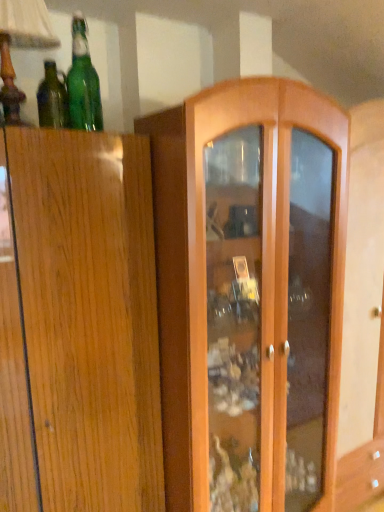
Question: Is green glass bottle at upper left, which appears as the 2th bottle when viewed from the left, taller or shorter than green glass bottle at upper left, placed as the 2th bottle when sorted from right to left?

Choices:
 (A) short
 (B) tall

Answer: (B)

Question: Looking at their shapes, would you say green glass bottle at upper left, placed as the first bottle when sorted from right to left, is wider or thinner than green glass bottle at upper left, placed as the 2th bottle when sorted from right to left?

Choices:
 (A) thin
 (B) wide

Answer: (B)

Question: Based on their relative distances, which object is nearer to the green glass bottle at upper left, placed as the first bottle when sorted from right to left?

Choices:
 (A) green glass bottle at upper left, the 1th bottle positioned from the left
 (B) wooden table lamp at upper left

Answer: (A)

Question: Considering the real-world distances, which object is farthest from the green glass bottle at upper left, the 1th bottle positioned from the left?

Choices:
 (A) wooden table lamp at upper left
 (B) green glass bottle at upper left, which appears as the 2th bottle when viewed from the left

Answer: (A)